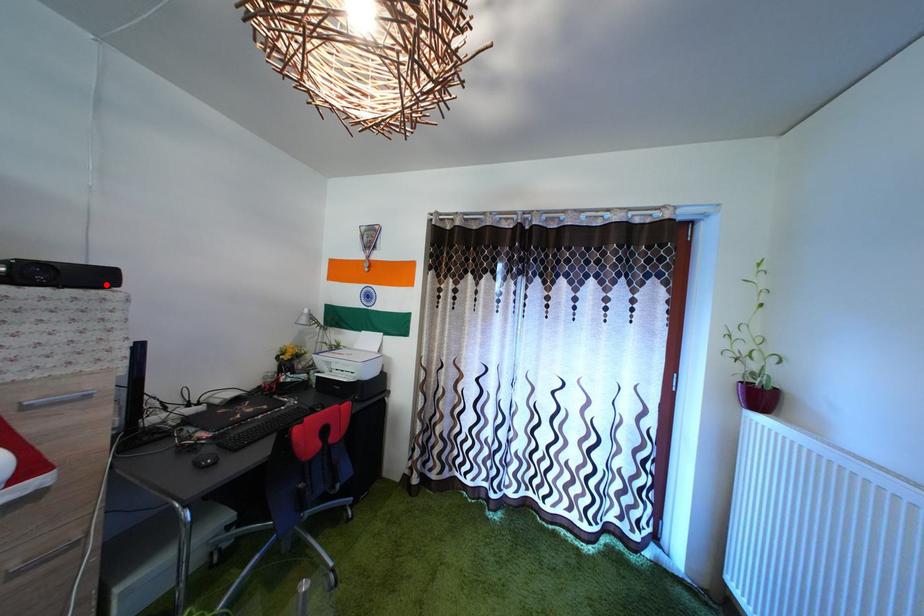
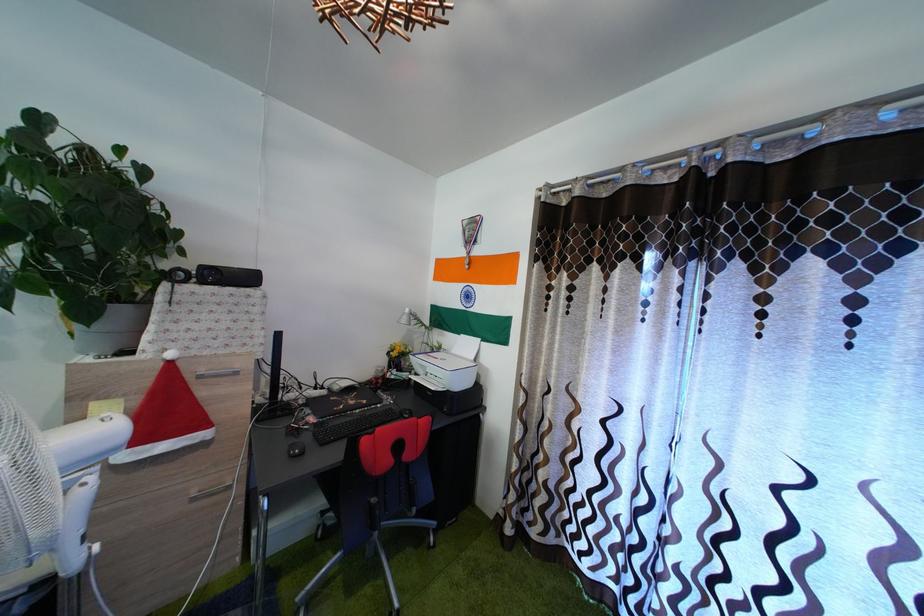
In the second image, find the point that corresponds to the highlighted location in the first image.

(257, 286)